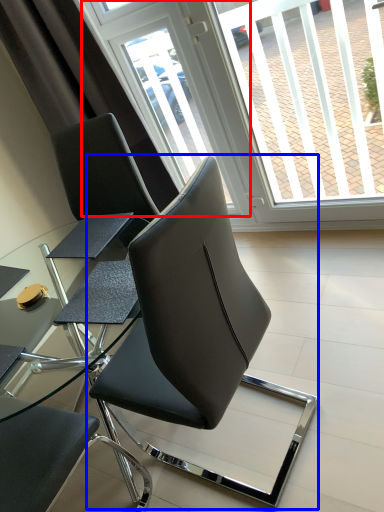
Question: Which point is further to the camera, screen door (highlighted by a red box) or chair (highlighted by a blue box)?

Choices:
 (A) screen door
 (B) chair

Answer: (A)